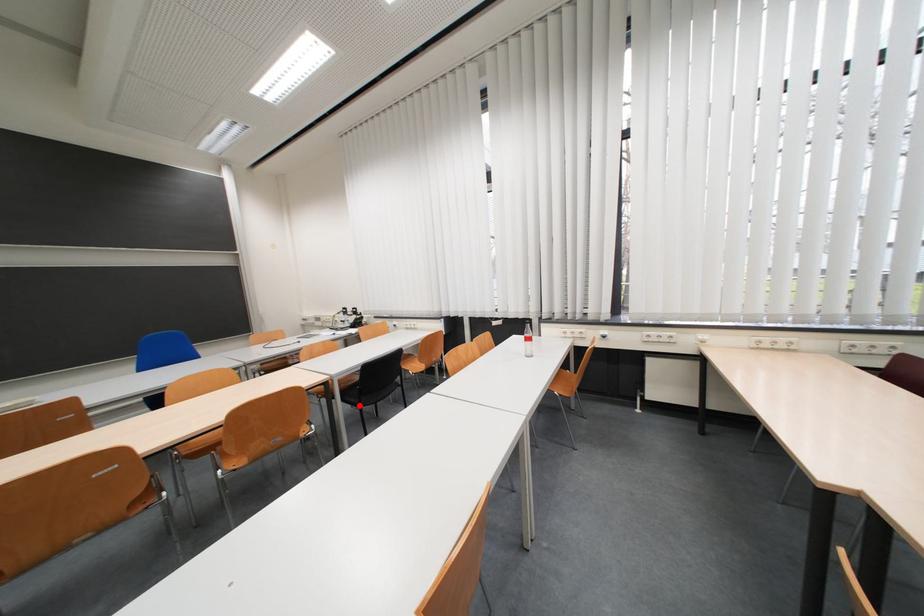
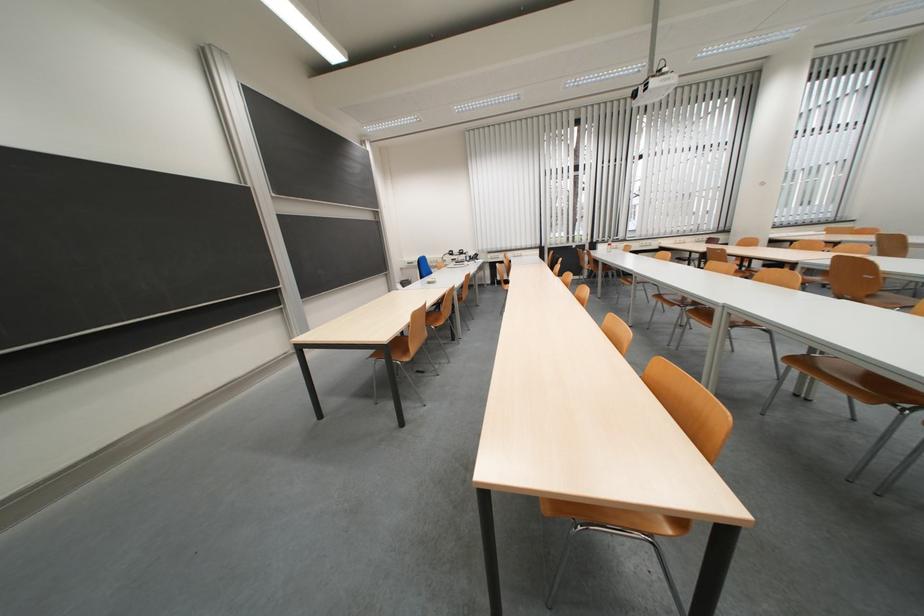
Question: I am providing you with two images of the same scene from different viewpoints. A red point is marked on the first image. Is the red point's position out of view in image 2?

Choices:
 (A) Yes
 (B) No

Answer: (A)